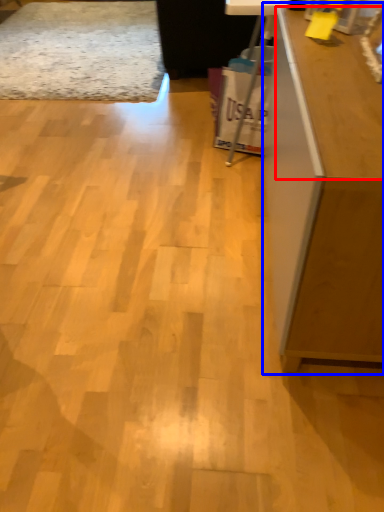
Question: Among these objects, which one is nearest to the camera, counter top (highlighted by a red box) or furniture (highlighted by a blue box)?

Choices:
 (A) counter top
 (B) furniture

Answer: (B)